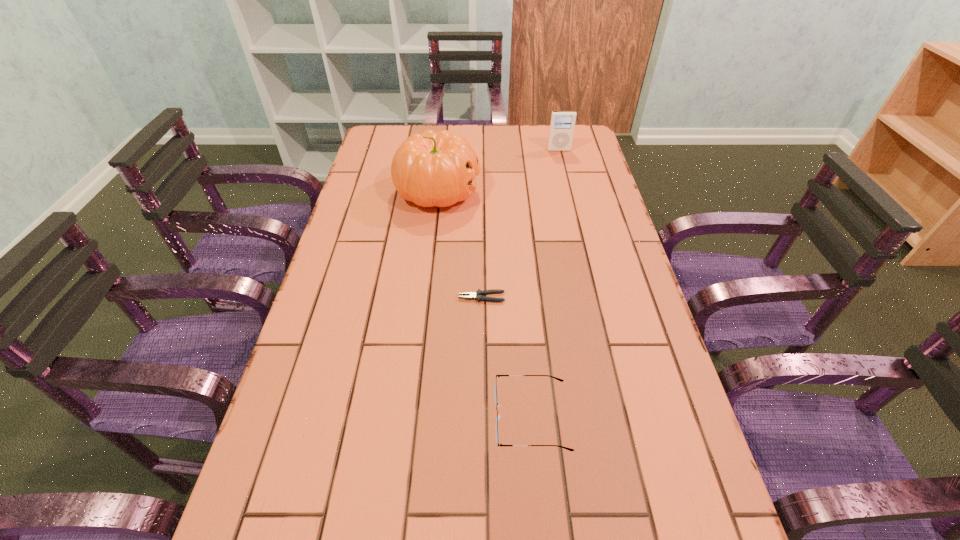
At what (x,y) coordinates should I click in order to perform the action: click on free space between the third farthest object and the second tallest object. Please return your answer as a coordinate pair (x, y). Looking at the image, I should click on (520, 224).

At what (x,y) coordinates should I click in order to perform the action: click on vacant space that's between the shortest object and the spectacles. Please return your answer as a coordinate pair (x, y). Image resolution: width=960 pixels, height=540 pixels. Looking at the image, I should click on (507, 357).

Where is `free space between the second shortest object and the third shortest object`? This screenshot has width=960, height=540. free space between the second shortest object and the third shortest object is located at coordinates (545, 284).

Locate which object is the third closest to the nearest object. Please provide its 2D coordinates. Your answer should be formatted as a tuple, i.e. [(x, y)], where the tuple contains the x and y coordinates of a point satisfying the conditions above.

[(562, 124)]

Point out which object is positioned as the nearest to the pliers. Please provide its 2D coordinates. Your answer should be formatted as a tuple, i.e. [(x, y)], where the tuple contains the x and y coordinates of a point satisfying the conditions above.

[(498, 416)]

Where is `vacant region that satisfies the following two spatial constraints: 1. on the front-facing side of the second tallest object; 2. on the lenses of the nearest object`? vacant region that satisfies the following two spatial constraints: 1. on the front-facing side of the second tallest object; 2. on the lenses of the nearest object is located at coordinates (623, 417).

The height and width of the screenshot is (540, 960). Identify the location of free location that satisfies the following two spatial constraints: 1. on the front-facing side of the rightmost object; 2. on the carved face of the tallest object. (568, 191).

You are a GUI agent. You are given a task and a screenshot of the screen. Output one action in this format:
    pyautogui.click(x=<x>, y=<y>)
    Task: Click on the free space that satisfies the following two spatial constraints: 1. on the front-facing side of the farthest object; 2. at the gripping part of the second nearest object
    This screenshot has width=960, height=540.
    Given the screenshot: What is the action you would take?
    pyautogui.click(x=594, y=298)

Where is `vacant region that satisfies the following two spatial constraints: 1. on the front-facing side of the third shortest object; 2. at the gripping part of the pliers`? vacant region that satisfies the following two spatial constraints: 1. on the front-facing side of the third shortest object; 2. at the gripping part of the pliers is located at coordinates (594, 298).

At what (x,y) coordinates should I click in order to perform the action: click on blank space that satisfies the following two spatial constraints: 1. on the front-facing side of the iPod; 2. on the carved face of the tallest object. Please return your answer as a coordinate pair (x, y). Image resolution: width=960 pixels, height=540 pixels. Looking at the image, I should click on (568, 191).